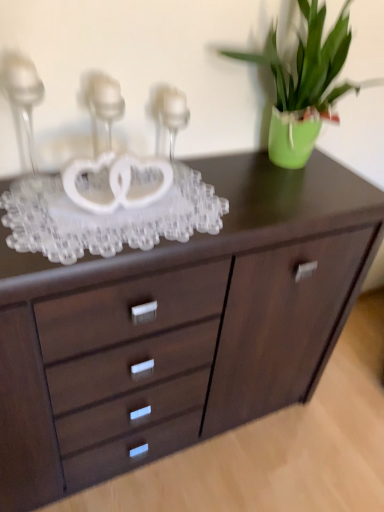
Where is `free space above dark wood chest of drawers at center (from a real-world perspective)`? Image resolution: width=384 pixels, height=512 pixels. free space above dark wood chest of drawers at center (from a real-world perspective) is located at coordinates (293, 429).